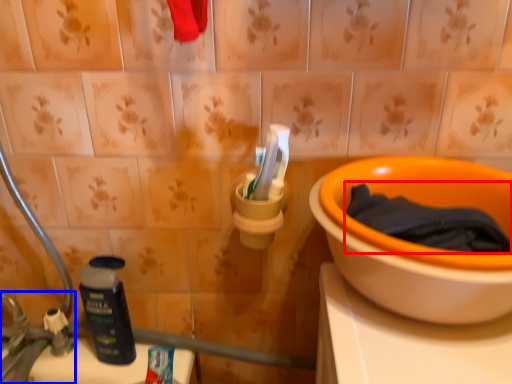
Question: Among these objects, which one is farthest to the camera, bath towel (highlighted by a red box) or faucet (highlighted by a blue box)?

Choices:
 (A) bath towel
 (B) faucet

Answer: (B)